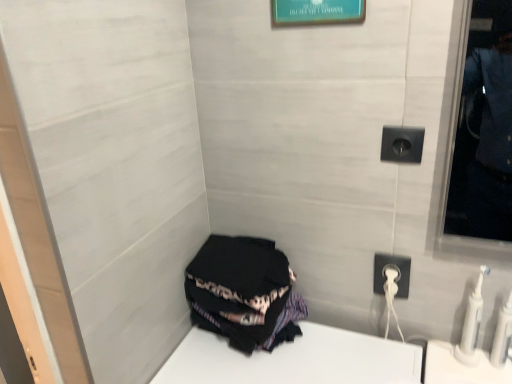
Question: Should I look upward or downward to see white plastic toothbrush at lower right, which is counted as the 1th toiletry, starting from the left?

Choices:
 (A) up
 (B) down

Answer: (B)

Question: Should I look upward or downward to see white plastic toothbrushes at lower right, acting as the 2th toiletry starting from the left?

Choices:
 (A) down
 (B) up

Answer: (A)

Question: From a real-world perspective, is white plastic power outlet at lower right positioned over white plastic toothbrushes at lower right, which ranks as the 1th toiletry in right-to-left order, based on gravity?

Choices:
 (A) yes
 (B) no

Answer: (A)

Question: Does white plastic power outlet at lower right have a greater width compared to white plastic toothbrushes at lower right, which ranks as the 1th toiletry in right-to-left order?

Choices:
 (A) yes
 (B) no

Answer: (B)

Question: Considering the relative sizes of white plastic power outlet at lower right and white plastic toothbrushes at lower right, which ranks as the 1th toiletry in right-to-left order, in the image provided, is white plastic power outlet at lower right bigger than white plastic toothbrushes at lower right, which ranks as the 1th toiletry in right-to-left order,?

Choices:
 (A) no
 (B) yes

Answer: (A)

Question: Considering the relative sizes of white plastic power outlet at lower right and white plastic toothbrushes at lower right, which ranks as the 1th toiletry in right-to-left order, in the image provided, is white plastic power outlet at lower right taller than white plastic toothbrushes at lower right, which ranks as the 1th toiletry in right-to-left order,?

Choices:
 (A) no
 (B) yes

Answer: (A)

Question: From the image's perspective, is white plastic power outlet at lower right beneath white plastic toothbrushes at lower right, acting as the 2th toiletry starting from the left?

Choices:
 (A) no
 (B) yes

Answer: (A)

Question: Is the position of white plastic power outlet at lower right less distant than that of white plastic toothbrushes at lower right, acting as the 2th toiletry starting from the left?

Choices:
 (A) yes
 (B) no

Answer: (B)

Question: From a real-world perspective, is white plastic toothbrushes at lower right, acting as the 2th toiletry starting from the left, located higher than black plastic outlet at upper right?

Choices:
 (A) no
 (B) yes

Answer: (A)

Question: From the image's perspective, is white plastic toothbrushes at lower right, acting as the 2th toiletry starting from the left, above black plastic outlet at upper right?

Choices:
 (A) no
 (B) yes

Answer: (A)

Question: Can you confirm if white plastic toothbrushes at lower right, which ranks as the 1th toiletry in right-to-left order, is shorter than black plastic outlet at upper right?

Choices:
 (A) yes
 (B) no

Answer: (B)

Question: Is white plastic toothbrushes at lower right, which ranks as the 1th toiletry in right-to-left order, further to the viewer compared to black plastic outlet at upper right?

Choices:
 (A) no
 (B) yes

Answer: (A)

Question: From the image's perspective, is white plastic toothbrushes at lower right, acting as the 2th toiletry starting from the left, beneath black plastic outlet at upper right?

Choices:
 (A) yes
 (B) no

Answer: (A)

Question: Could you tell me if white plastic toothbrushes at lower right, which ranks as the 1th toiletry in right-to-left order, is facing black plastic outlet at upper right?

Choices:
 (A) no
 (B) yes

Answer: (A)

Question: From a real-world perspective, is teal glossy picture frame at upper center over white plastic power outlet at lower right?

Choices:
 (A) no
 (B) yes

Answer: (B)